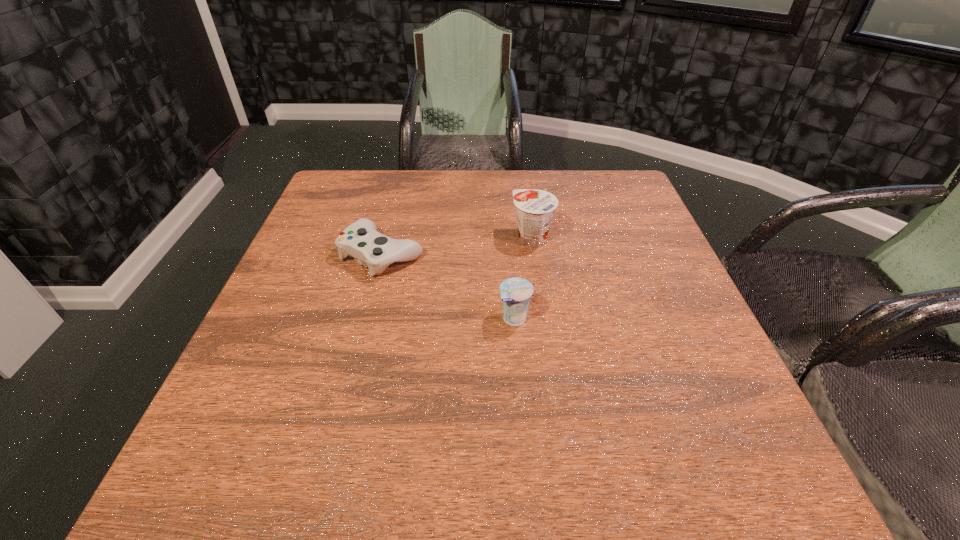
The height and width of the screenshot is (540, 960). I want to click on the farther yogurt, so click(535, 208).

What are the coordinates of `the taller yogurt` in the screenshot? It's located at (535, 208).

Identify the location of the second shortest object. (515, 292).

Where is `the nearest object`? The height and width of the screenshot is (540, 960). the nearest object is located at coordinates (515, 292).

Where is `the shortest object`? the shortest object is located at coordinates (361, 240).

Image resolution: width=960 pixels, height=540 pixels. What are the coordinates of `control` in the screenshot? It's located at (361, 240).

The width and height of the screenshot is (960, 540). Identify the location of vacant point located on the right of the tallest object. (662, 239).

Image resolution: width=960 pixels, height=540 pixels. I want to click on vacant space positioned 0.110m on the front of the nearest object, so click(x=519, y=378).

This screenshot has height=540, width=960. I want to click on free location located on the right of the control, so pyautogui.click(x=499, y=254).

Image resolution: width=960 pixels, height=540 pixels. Find the location of `object present at the left edge`. object present at the left edge is located at coordinates click(361, 240).